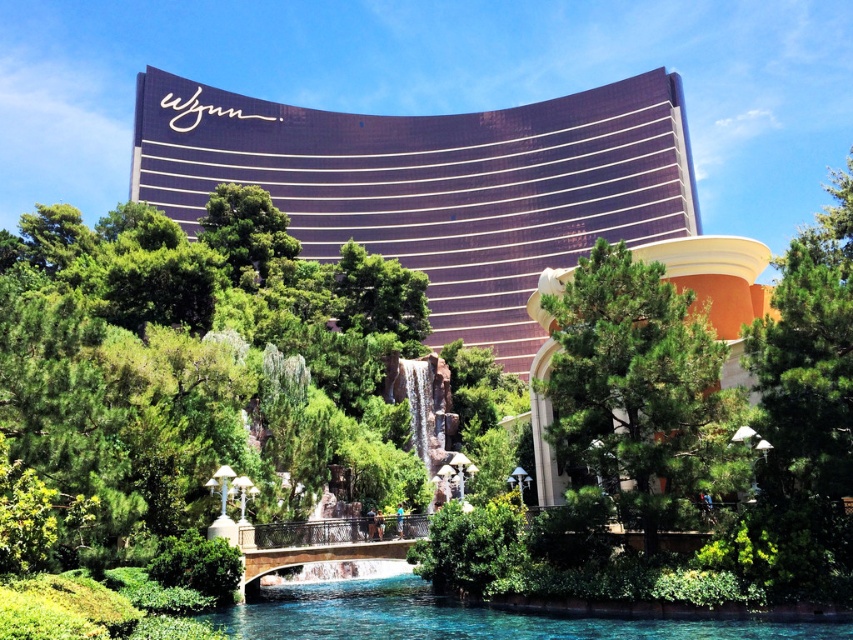
You are standing in front of the Wynn Las Vegas hotel and want to take a photo of the green pine tree at center and the clear blue water at lower center. Which object will appear closer to you in the photo?

The green pine tree at center will appear closer to you in the photo because it is further to the viewer than the clear blue water at lower center.

You are a photographer planning to capture the metallic gold hotel at upper center and the clear blue water at lower center in a single shot. Based on their positions, can you determine which object appears higher in the image?

The metallic gold hotel at upper center is positioned over clear blue water at lower center, so the metallic gold hotel at upper center appears higher in the image.

You are standing at the point marked by the coordinates point (637, 387) in the image. What object are you directly in front of?

The point (637, 387) marks green pine tree at center, so you are directly in front of the green pine tree at center.